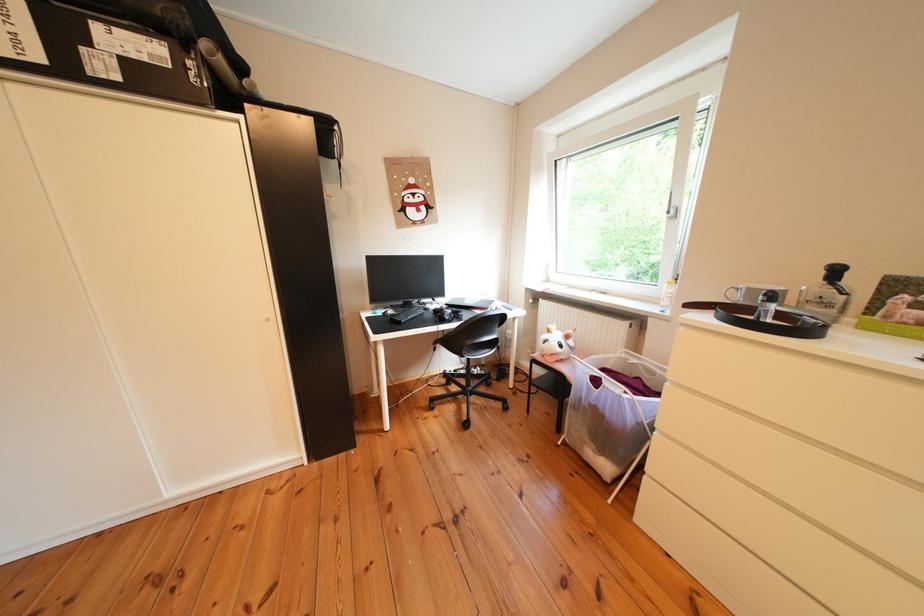
Find the location of `chair sitting surface`. chair sitting surface is located at coordinates (471, 339).